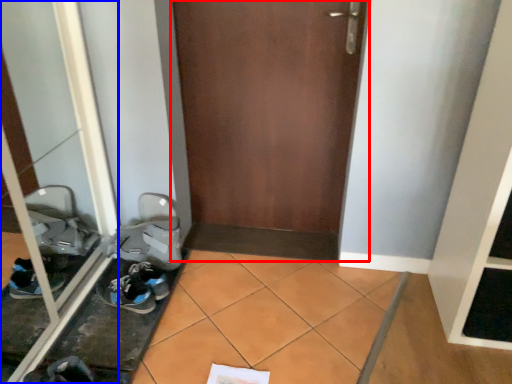
Question: Among these objects, which one is nearest to the camera, door (highlighted by a red box) or glass door (highlighted by a blue box)?

Choices:
 (A) door
 (B) glass door

Answer: (B)